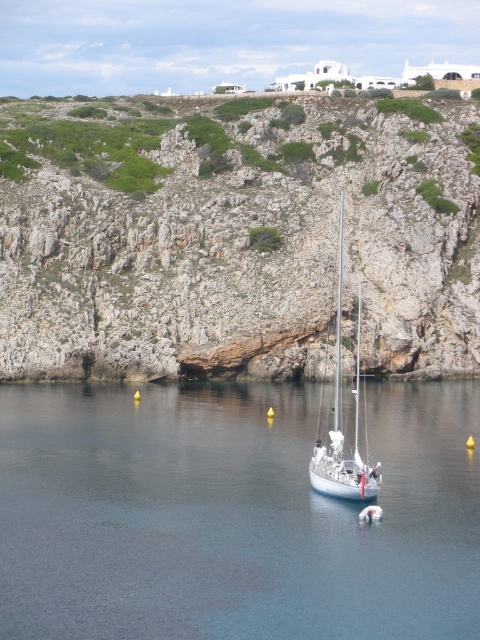
Question: Does clear blue water at center appear on the left side of white glossy sailboat at center?

Choices:
 (A) yes
 (B) no

Answer: (A)

Question: Among these points, which one is nearest to the camera?

Choices:
 (A) (363, 476)
 (B) (266, 584)

Answer: (B)

Question: Is clear blue water at center smaller than white glossy sailboat at center?

Choices:
 (A) no
 (B) yes

Answer: (A)

Question: Can you confirm if rocky cliff at center is smaller than clear blue water at center?

Choices:
 (A) yes
 (B) no

Answer: (B)

Question: Which of the following is the closest to the observer?

Choices:
 (A) rocky cliff at center
 (B) white glossy sailboat at center
 (C) clear blue water at center

Answer: (C)

Question: Which object is positioned farthest from the rocky cliff at center?

Choices:
 (A) clear blue water at center
 (B) white glossy sailboat at center

Answer: (A)